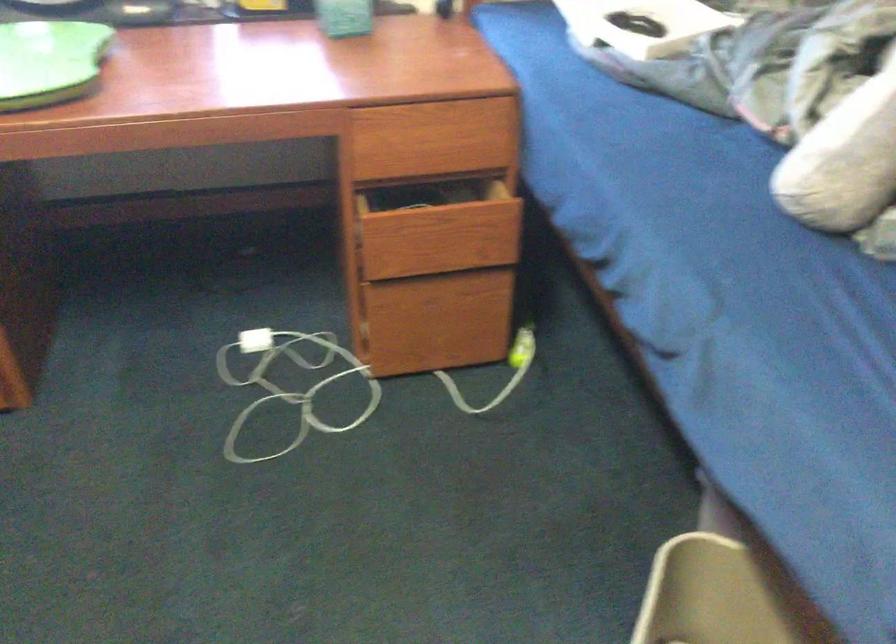
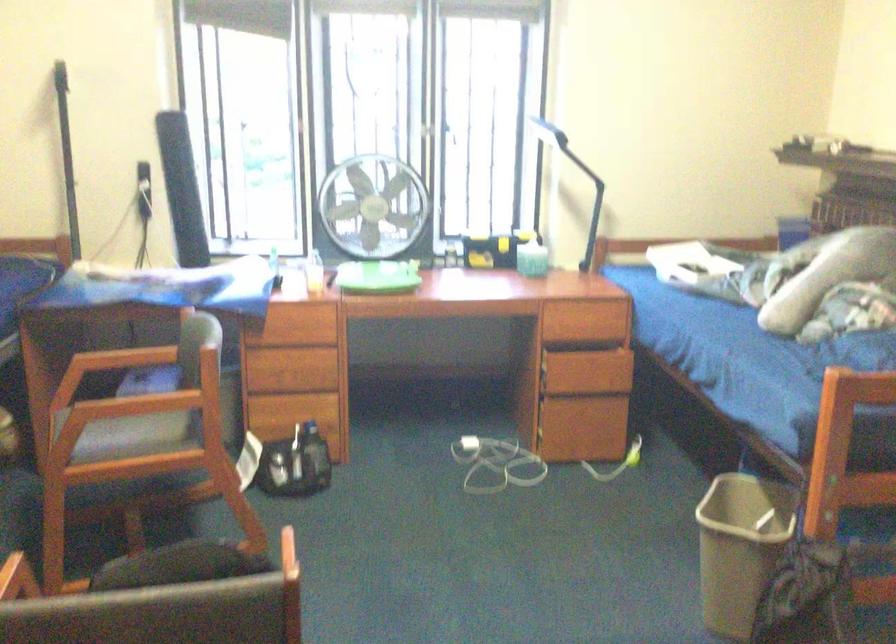
In the second image, find the point that corresponds to point (451, 138) in the first image.

(596, 319)